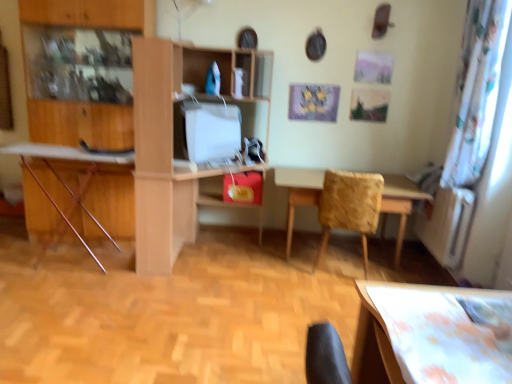
Question: Can you confirm if wooden ironing board at left is thinner than light wood/wooden desk at center?

Choices:
 (A) no
 (B) yes

Answer: (B)

Question: Does wooden ironing board at left lie behind light wood/wooden desk at center?

Choices:
 (A) yes
 (B) no

Answer: (A)

Question: From the image's perspective, is wooden ironing board at left on top of light wood/wooden desk at center?

Choices:
 (A) yes
 (B) no

Answer: (B)

Question: Is wooden ironing board at left located outside light wood/wooden desk at center?

Choices:
 (A) yes
 (B) no

Answer: (A)

Question: From a real-world perspective, is wooden ironing board at left located beneath light wood/wooden desk at center?

Choices:
 (A) yes
 (B) no

Answer: (A)

Question: From a real-world perspective, is light wood/wooden desk at center positioned above or below wooden textured table at center?

Choices:
 (A) above
 (B) below

Answer: (A)

Question: Do you think light wood/wooden desk at center is within wooden textured table at center, or outside of it?

Choices:
 (A) inside
 (B) outside

Answer: (B)

Question: Is light wood/wooden desk at center wider or thinner than wooden textured table at center?

Choices:
 (A) thin
 (B) wide

Answer: (B)

Question: Considering the positions of light wood/wooden desk at center and wooden textured table at center in the image, is light wood/wooden desk at center bigger or smaller than wooden textured table at center?

Choices:
 (A) big
 (B) small

Answer: (A)

Question: In terms of size, does wooden chair at center appear bigger or smaller than wooden textured table at center?

Choices:
 (A) big
 (B) small

Answer: (B)

Question: From a real-world perspective, is wooden chair at center above or below wooden textured table at center?

Choices:
 (A) above
 (B) below

Answer: (A)

Question: From the image's perspective, is wooden chair at center above or below wooden textured table at center?

Choices:
 (A) below
 (B) above

Answer: (B)

Question: Considering the relative positions of wooden chair at center and wooden textured table at center in the image provided, is wooden chair at center to the left or to the right of wooden textured table at center?

Choices:
 (A) right
 (B) left

Answer: (B)

Question: Based on their sizes in the image, would you say wooden ironing board at left is bigger or smaller than wooden textured table at center?

Choices:
 (A) small
 (B) big

Answer: (A)

Question: Considering the positions of point (128, 158) and point (281, 178), is point (128, 158) closer or farther from the camera than point (281, 178)?

Choices:
 (A) farther
 (B) closer

Answer: (B)